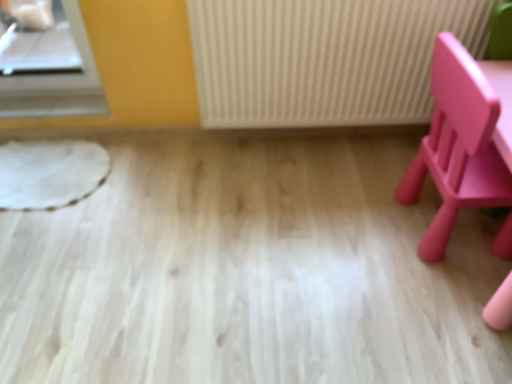
What are the coordinates of `free location to the left of matte pink chair at right` in the screenshot? It's located at (360, 226).